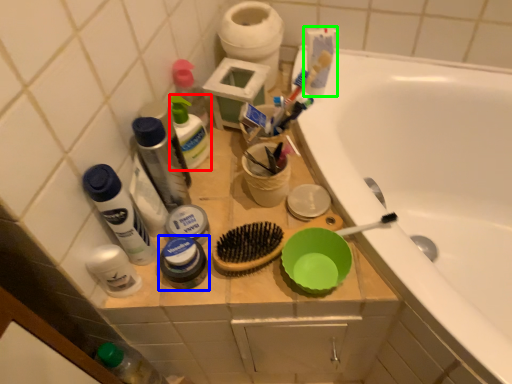
Question: Considering the real-world distances, which object is farthest from cleaning product (highlighted by a red box)? toiletry (highlighted by a blue box) or toothpaste (highlighted by a green box)?

Choices:
 (A) toiletry
 (B) toothpaste

Answer: (B)